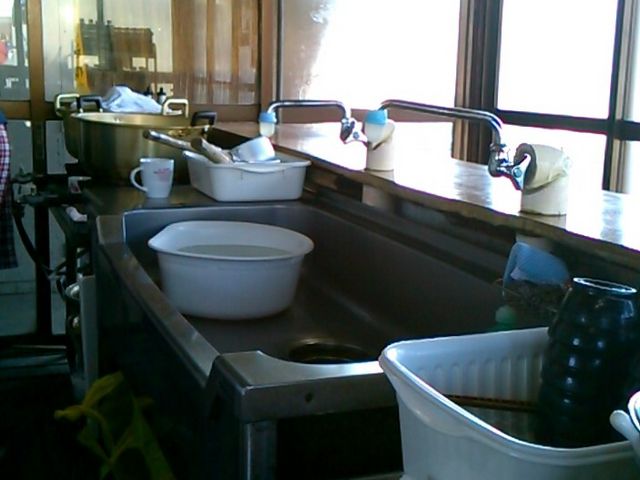
Identify the location of stainless steel sink. (310, 310).